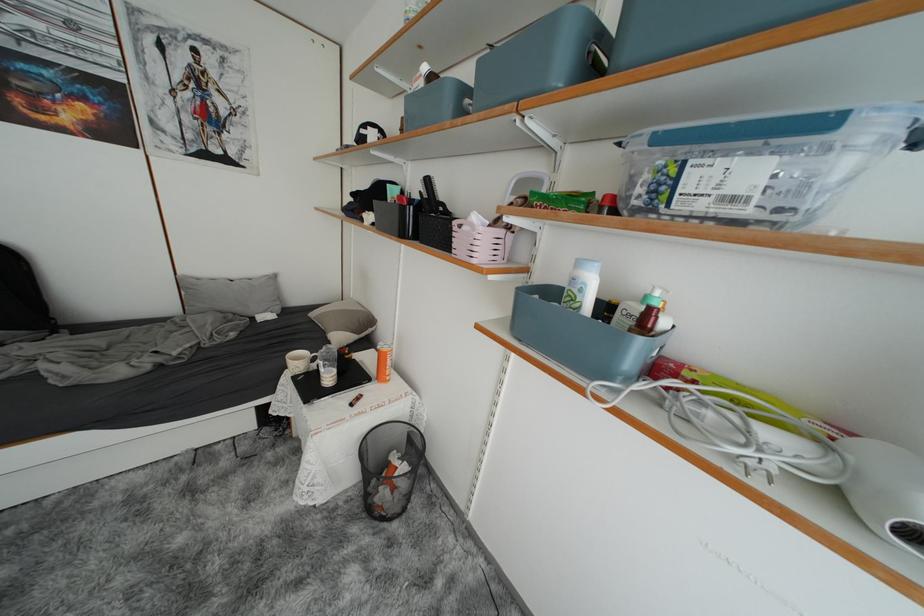
You are a GUI agent. You are given a task and a screenshot of the screen. Output one action in this format:
    pyautogui.click(x=<x>, y=<y>)
    Task: Click on the container lid clip
    
    Given the screenshot: What is the action you would take?
    pyautogui.click(x=539, y=134)